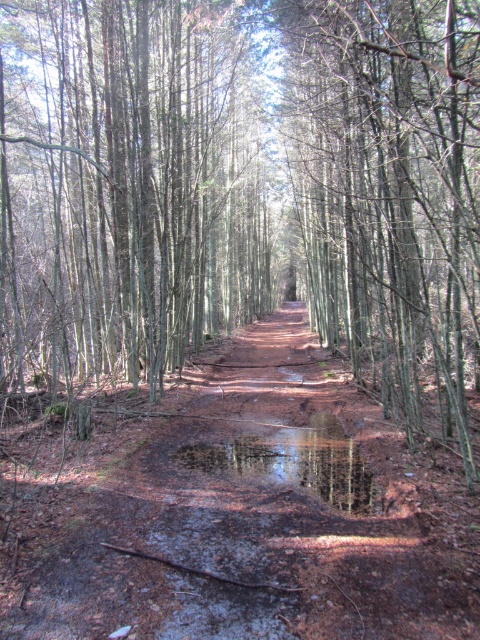
You are a hiker walking along the narrow dirt path in the forest. You notice a smooth bark tree at center and a glossy reflective puddle at center. Which object takes up more space in the scene?

The smooth bark tree at center is bigger than the glossy reflective puddle at center, so it takes up more space in the scene.

You are standing at the point closer to the viewer in the forest scene. There are two points marked on the path ahead of you at coordinates point (96, 512) and point (358, 348). Which point should you walk towards if you want to reach the one that is farther away from your current position?

You should walk towards point (358, 348) because it is farther away from your current position compared to point (96, 512) which is closer to the viewer.

You are a hiker navigating the forest path. You notice the brown dirt track at center and the smooth bark tree at center. Which object is positioned lower in the scene?

The brown dirt track at center is positioned lower than the smooth bark tree at center.